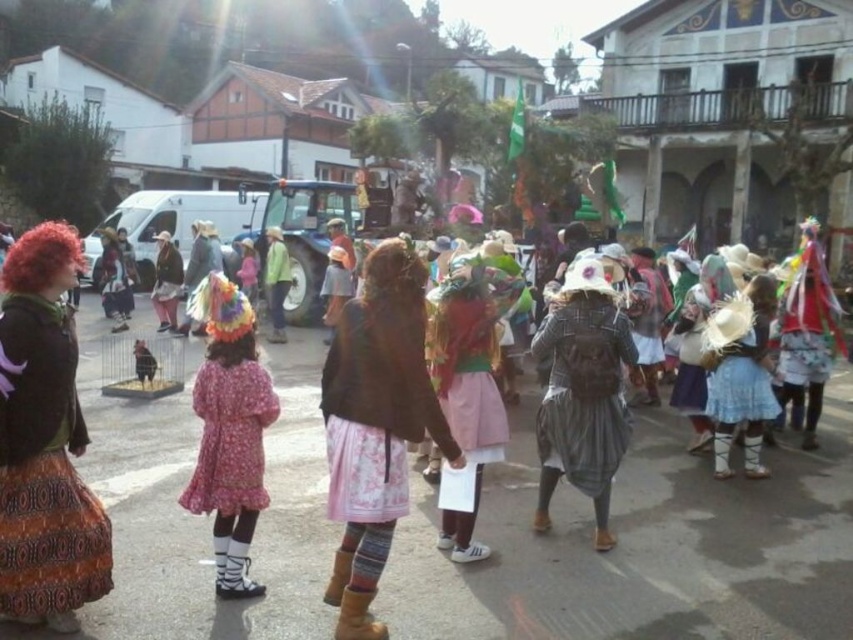
Does gray woolen coat at center lie behind blue cotton dress at right?

No, it is in front of blue cotton dress at right.

Can you confirm if gray woolen coat at center is positioned above blue cotton dress at right?

Actually, gray woolen coat at center is below blue cotton dress at right.

Image resolution: width=853 pixels, height=640 pixels. I want to click on gray woolen coat at center, so click(x=583, y=394).

Is point (566, 460) closer to camera compared to point (839, 307)?

Yes, it is.

What do you see at coordinates (583, 394) in the screenshot? I see `gray woolen coat at center` at bounding box center [583, 394].

Who is more distant from viewer, (602, 483) or (807, 250)?

Positioned behind is point (807, 250).

Locate an element on the screen. The image size is (853, 640). gray woolen coat at center is located at coordinates [583, 394].

Measure the distance between pink floral dress at center and blue cotton dress at right.

They are 4.00 meters apart.

Is pink floral dress at center smaller than blue cotton dress at right?

Yes, pink floral dress at center is smaller than blue cotton dress at right.

Locate an element on the screen. pink floral dress at center is located at coordinates (229, 432).